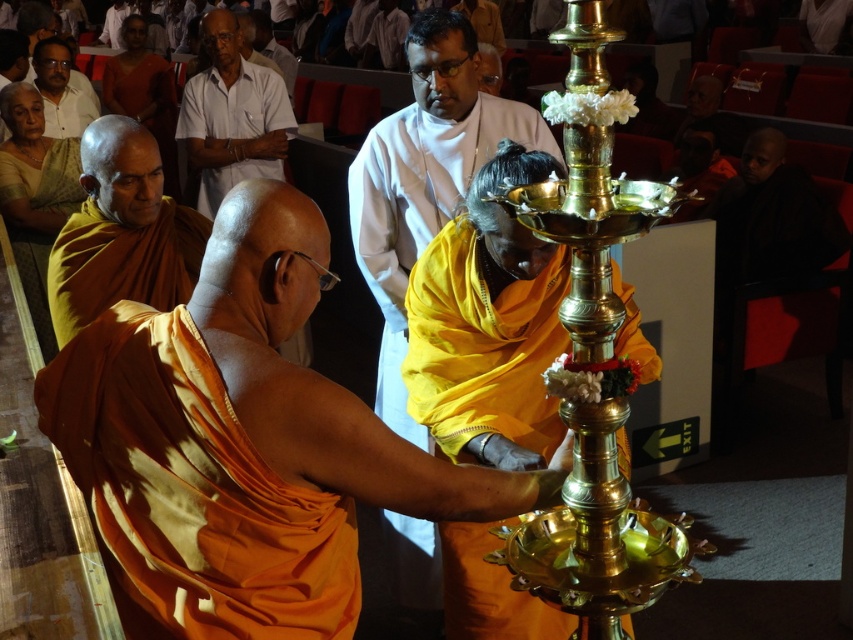
Question: Can you confirm if matte gold statue at center is bigger than white clothed man at upper left?

Choices:
 (A) yes
 (B) no

Answer: (A)

Question: Estimate the real-world distances between objects in this image. Which object is farther from the white clothed man at upper left?

Choices:
 (A) orange silk robe at center
 (B) orange clothed monk at left
 (C) orange draped cloth at center

Answer: (A)

Question: From the image, what is the correct spatial relationship of golden polished oil lamp at center in relation to matte gold statue at center?

Choices:
 (A) below
 (B) above

Answer: (A)

Question: Estimate the real-world distances between objects in this image. Which object is closer to the orange clothed monk at left?

Choices:
 (A) matte gold statue at center
 (B) white clothed man at upper left
 (C) matte white shirt at upper left
 (D) golden polished oil lamp at center

Answer: (A)

Question: Does orange silk robe at center appear on the left side of golden polished oil lamp at center?

Choices:
 (A) no
 (B) yes

Answer: (B)

Question: Which object appears farthest from the camera in this image?

Choices:
 (A) golden polished oil lamp at center
 (B) orange draped cloth at center

Answer: (A)